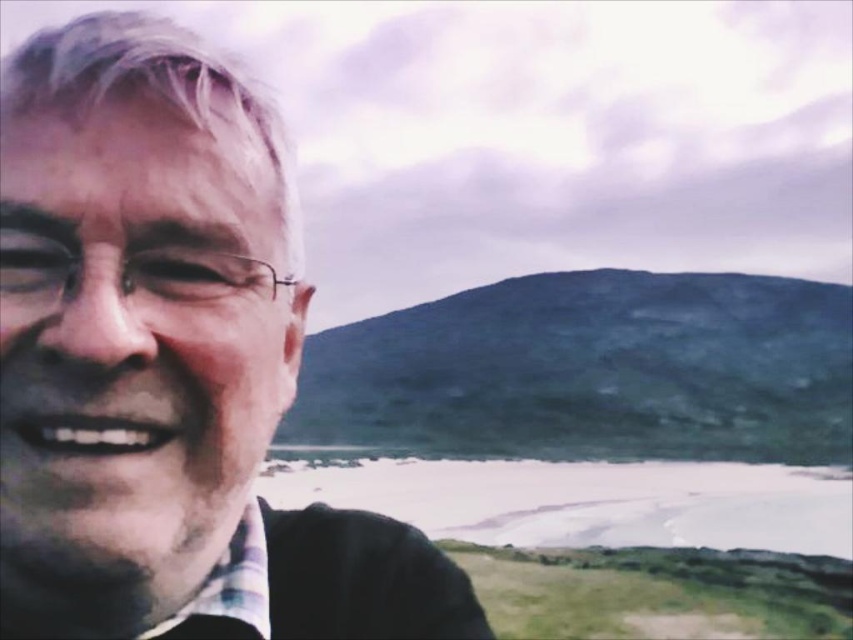
Question: Which point appears farthest from the camera in this image?

Choices:
 (A) (267, 625)
 (B) (287, 260)

Answer: (B)

Question: Among these objects, which one is nearest to the camera?

Choices:
 (A) matte black face at left
 (B) plaid fabric shirt at lower left

Answer: (A)

Question: Which of the following is the closest to the observer?

Choices:
 (A) (235, 566)
 (B) (88, 568)

Answer: (B)

Question: Is matte black face at left to the right of plaid fabric shirt at lower left from the viewer's perspective?

Choices:
 (A) yes
 (B) no

Answer: (B)

Question: Does matte black face at left have a lesser width compared to plaid fabric shirt at lower left?

Choices:
 (A) yes
 (B) no

Answer: (B)

Question: In this image, where is matte black face at left located relative to plaid fabric shirt at lower left?

Choices:
 (A) below
 (B) above

Answer: (B)